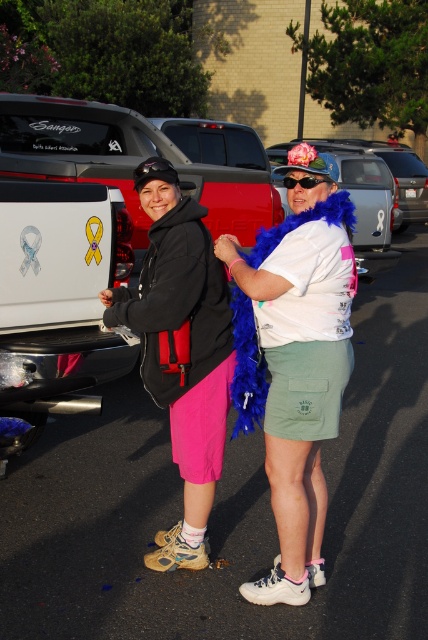
Can you confirm if pink fabric shorts at center is positioned above white glossy pickup truck at left?

No, pink fabric shorts at center is not above white glossy pickup truck at left.

The width and height of the screenshot is (428, 640). What do you see at coordinates (294, 362) in the screenshot? I see `pink fabric shorts at center` at bounding box center [294, 362].

Describe the element at coordinates (294, 362) in the screenshot. I see `pink fabric shorts at center` at that location.

Find the location of a particular element. The height and width of the screenshot is (640, 428). pink fabric shorts at center is located at coordinates (294, 362).

Can you confirm if pink fabric shorts at center is taller than matte black hoodie at center?

Yes, pink fabric shorts at center is taller than matte black hoodie at center.

Can you confirm if pink fabric shorts at center is shorter than matte black hoodie at center?

Incorrect, pink fabric shorts at center's height does not fall short of matte black hoodie at center's.

Is point (309, 579) behind point (198, 276)?

Yes, it is behind point (198, 276).

I want to click on pink fabric shorts at center, so click(294, 362).

Who is higher up, matte black hoodie at center or sunglasses at center?

sunglasses at center is higher up.

Which is more to the right, matte black hoodie at center or sunglasses at center?

sunglasses at center

Locate an element on the screen. matte black hoodie at center is located at coordinates (181, 349).

The width and height of the screenshot is (428, 640). I want to click on matte black hoodie at center, so click(181, 349).